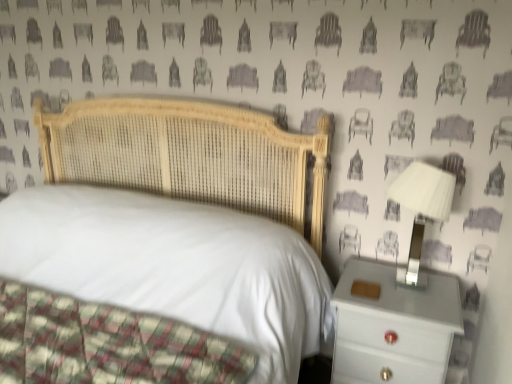
Locate an element on the screen. The width and height of the screenshot is (512, 384). free space that is to the left of white plastic lampshade at right is located at coordinates (374, 284).